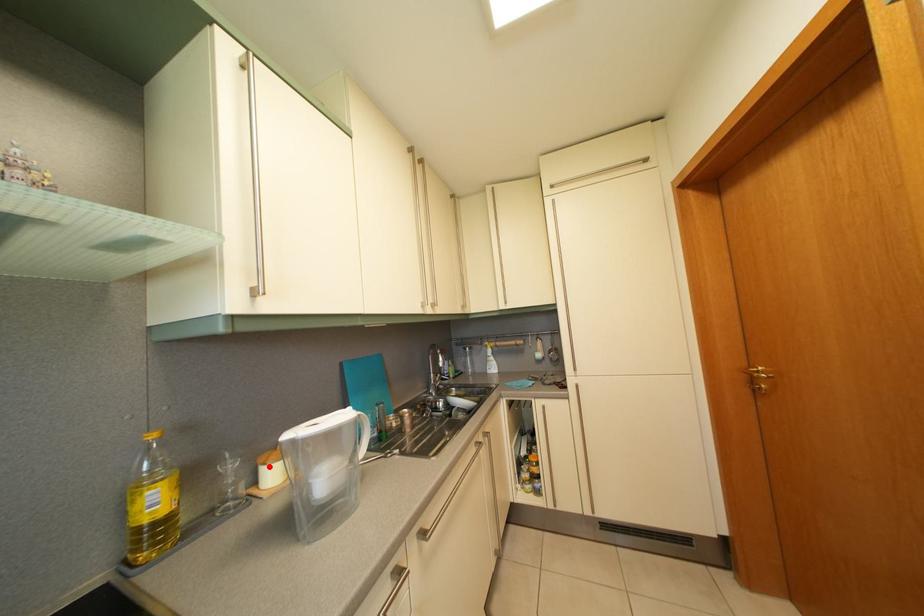
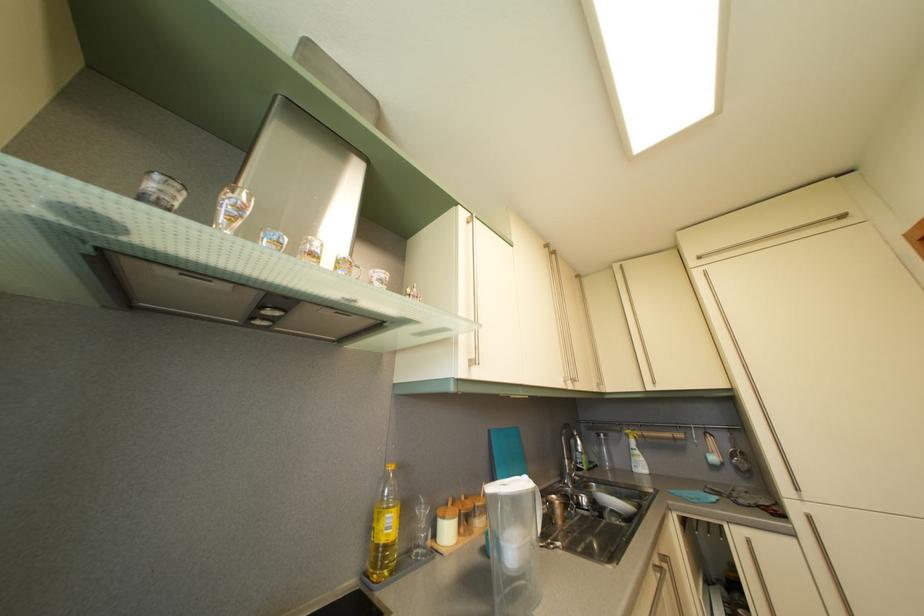
Locate, in the second image, the point that corresponds to the highlighted location in the first image.

(448, 519)